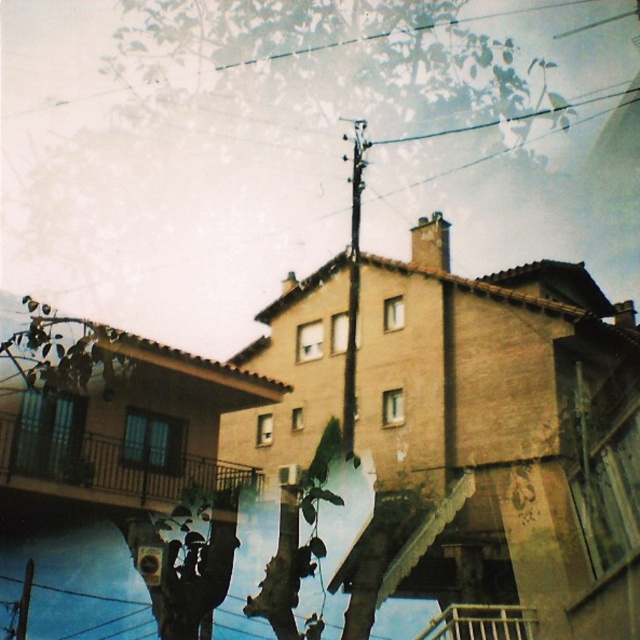
Is green matte tree at center wider than green leafy tree at center?

Incorrect, green matte tree at center's width does not surpass green leafy tree at center's.

Locate an element on the screen. green matte tree at center is located at coordinates [x=186, y=557].

At what (x,y) coordinates should I click in order to perform the action: click on green matte tree at center. Please return your answer as a coordinate pair (x, y). Looking at the image, I should click on (186, 557).

Image resolution: width=640 pixels, height=640 pixels. What do you see at coordinates (186, 557) in the screenshot?
I see `green matte tree at center` at bounding box center [186, 557].

Locate an element on the screen. Image resolution: width=640 pixels, height=640 pixels. green matte tree at center is located at coordinates (186, 557).

Can you confirm if green leafy tree at center is bigger than wooden at lower center?

Correct, green leafy tree at center is larger in size than wooden at lower center.

Does green leafy tree at center have a lesser width compared to wooden at lower center?

No, green leafy tree at center is not thinner than wooden at lower center.

What do you see at coordinates (298, 541) in the screenshot?
I see `green leafy tree at center` at bounding box center [298, 541].

This screenshot has height=640, width=640. In order to click on green leafy tree at center in this screenshot , I will do `click(298, 541)`.